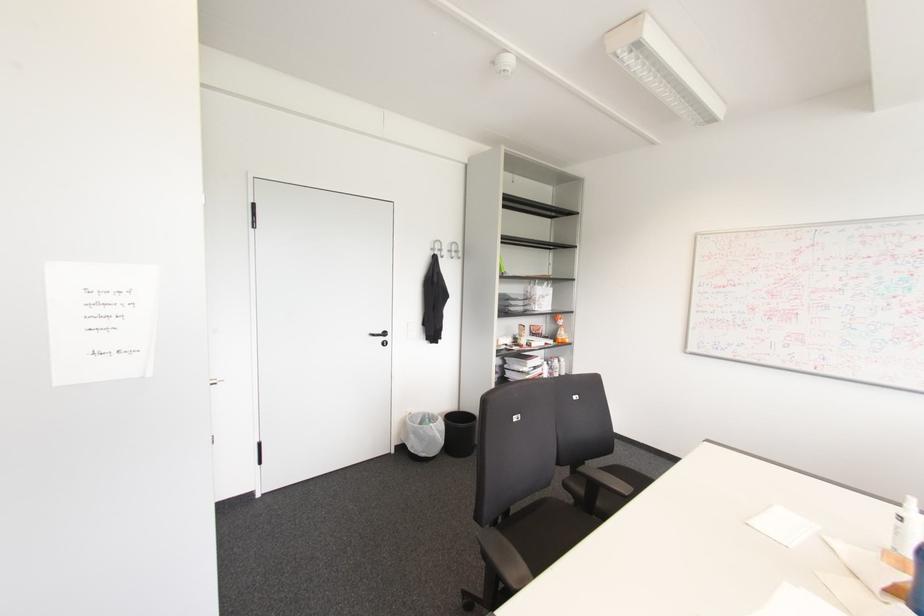
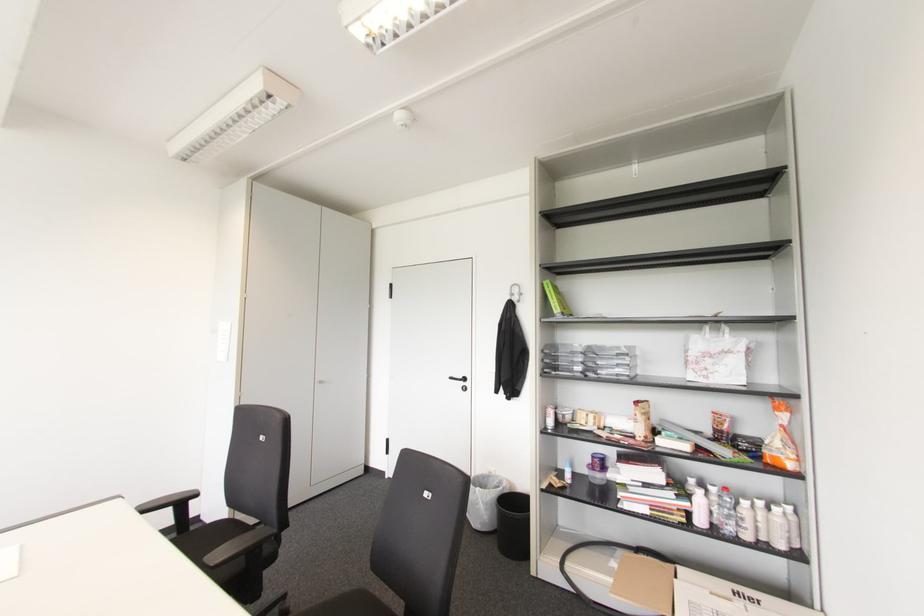
Where in the second image is the point corresponding to the point at 383,333 from the first image?

(464, 379)